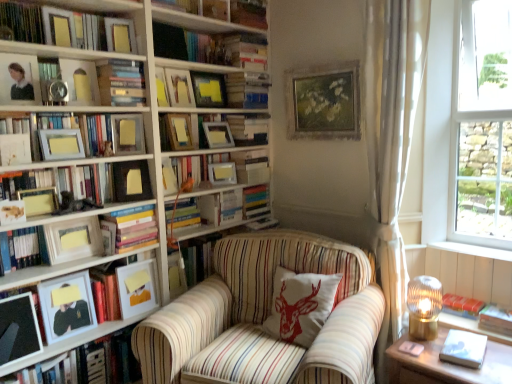
The width and height of the screenshot is (512, 384). Find the location of `free point above hardcover book at right, the 3th book positioned from the bottom (from a real-world perspective)`. free point above hardcover book at right, the 3th book positioned from the bottom (from a real-world perspective) is located at coordinates (459, 318).